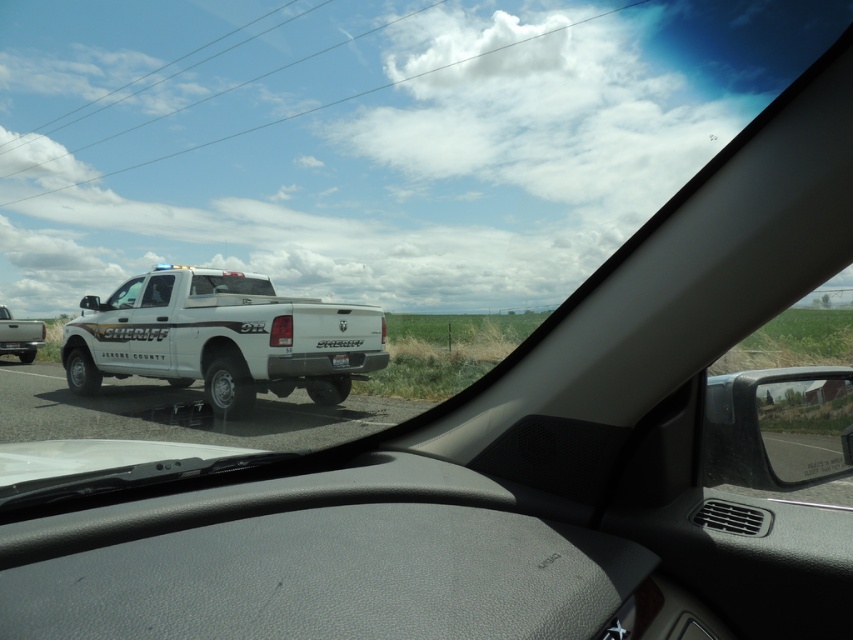
You are a driver approaching an intersection and see two vehicles ahead. The white matte sheriff truck at center and the white matte pickup truck at left. Which vehicle is positioned higher in the image?

The white matte sheriff truck at center is positioned higher than the white matte pickup truck at left in the image.

You are a driver looking through the clear glass windshield at center to see the white sheriff vehicle parked ahead. Can you clearly read the white matte license plate at center on the other vehicle from your current position?

The white matte license plate at center is behind the clear glass windshield at center, so it would be obscured by the windshield, making it difficult to read clearly from your current position.